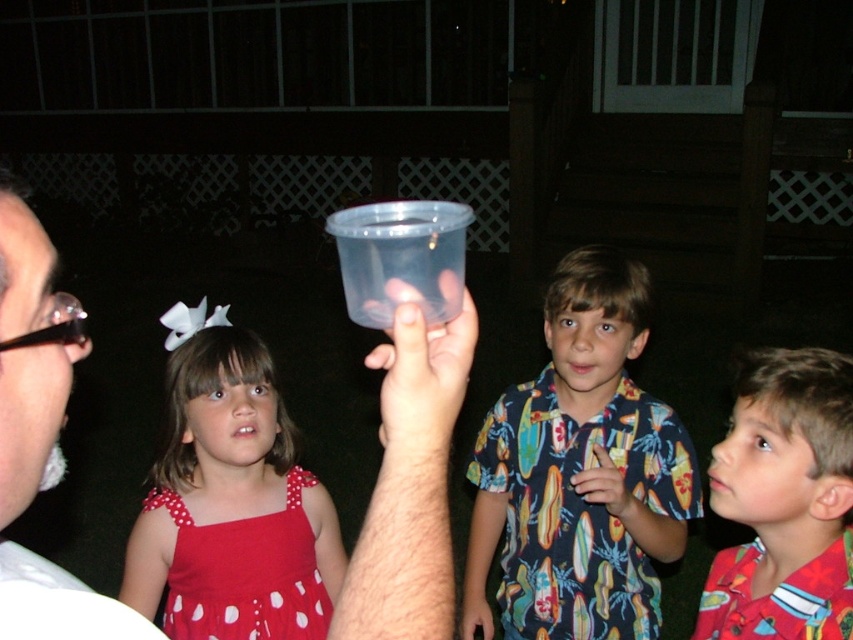
Measure the distance from matte red dress at left to red cotton shirt at center.

3.28 feet

Does point (241, 621) come closer to viewer compared to point (804, 484)?

No, (241, 621) is further to viewer.

Find the location of `matte red dress at left`. matte red dress at left is located at coordinates (230, 500).

Does matte red dress at left have a greater height compared to transparent plastic cup at center?

Correct, matte red dress at left is much taller as transparent plastic cup at center.

Describe the element at coordinates (230, 500) in the screenshot. This screenshot has width=853, height=640. I see `matte red dress at left` at that location.

This screenshot has height=640, width=853. In order to click on matte red dress at left in this screenshot , I will do coord(230,500).

How far apart are printed fabric shirt at center and red cotton shirt at center?

A distance of 15.64 inches exists between printed fabric shirt at center and red cotton shirt at center.

Where is `printed fabric shirt at center`? printed fabric shirt at center is located at coordinates (579, 472).

You are a GUI agent. You are given a task and a screenshot of the screen. Output one action in this format:
    pyautogui.click(x=<x>, y=<y>)
    Task: Click on the printed fabric shirt at center
    The width and height of the screenshot is (853, 640).
    Given the screenshot: What is the action you would take?
    pyautogui.click(x=579, y=472)